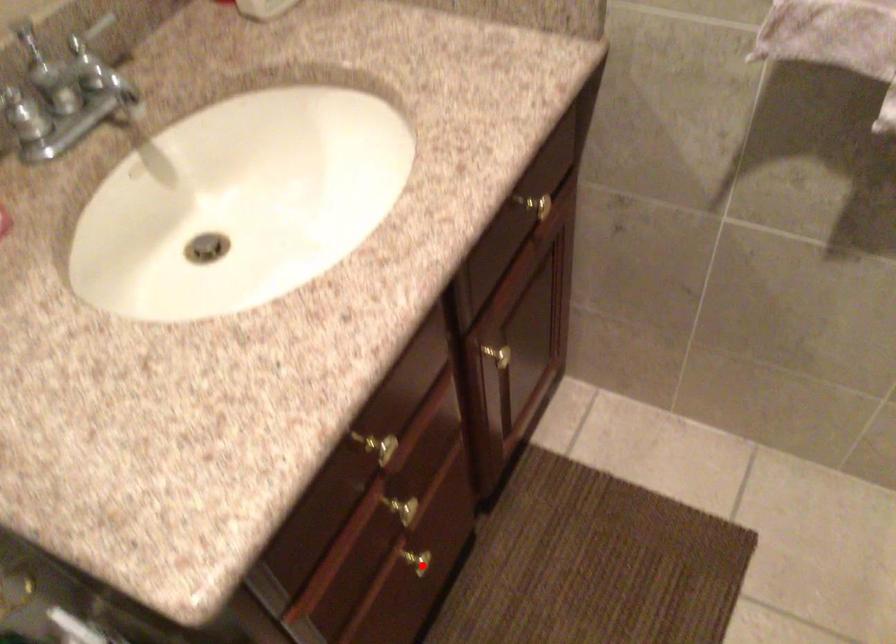
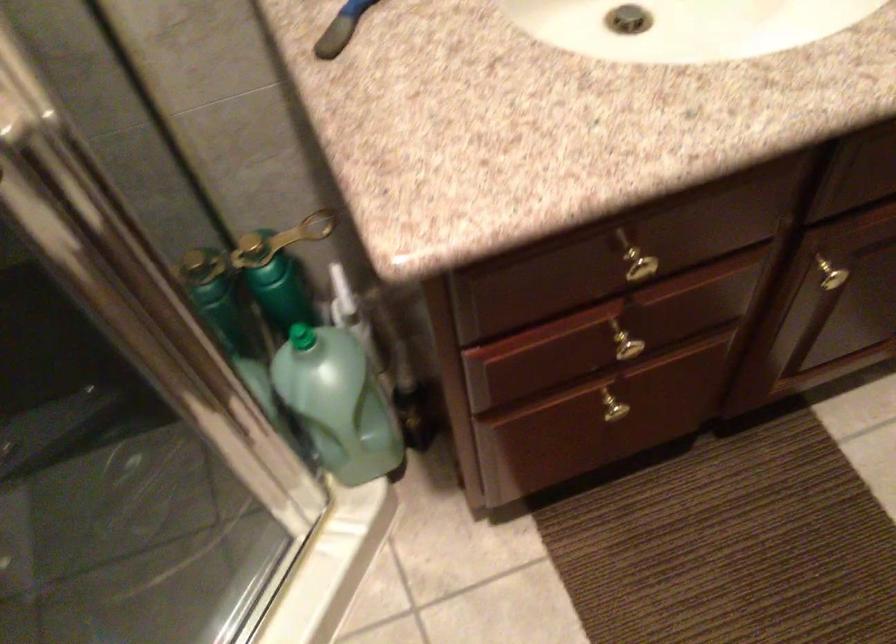
In the second image, find the point that corresponds to the highlighted location in the first image.

(616, 411)